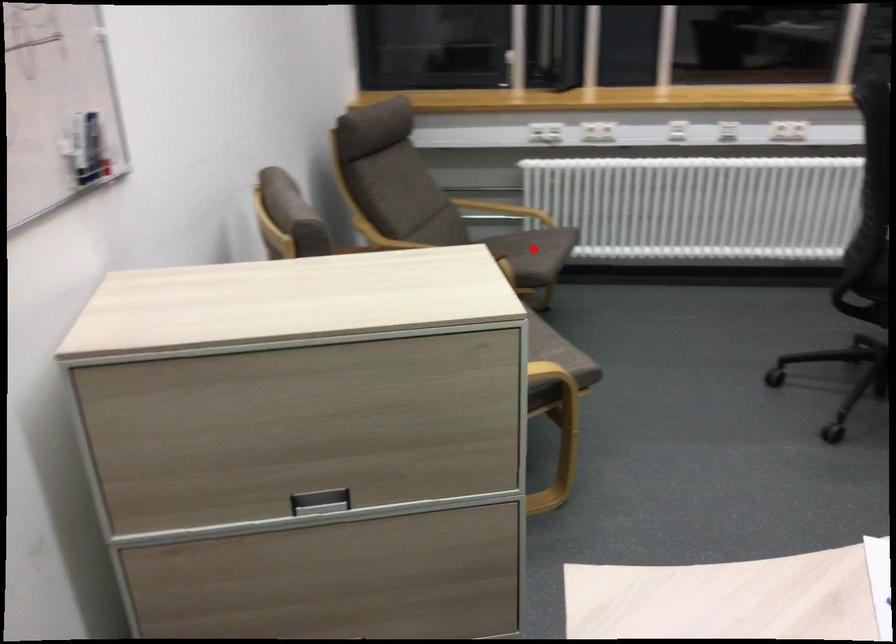
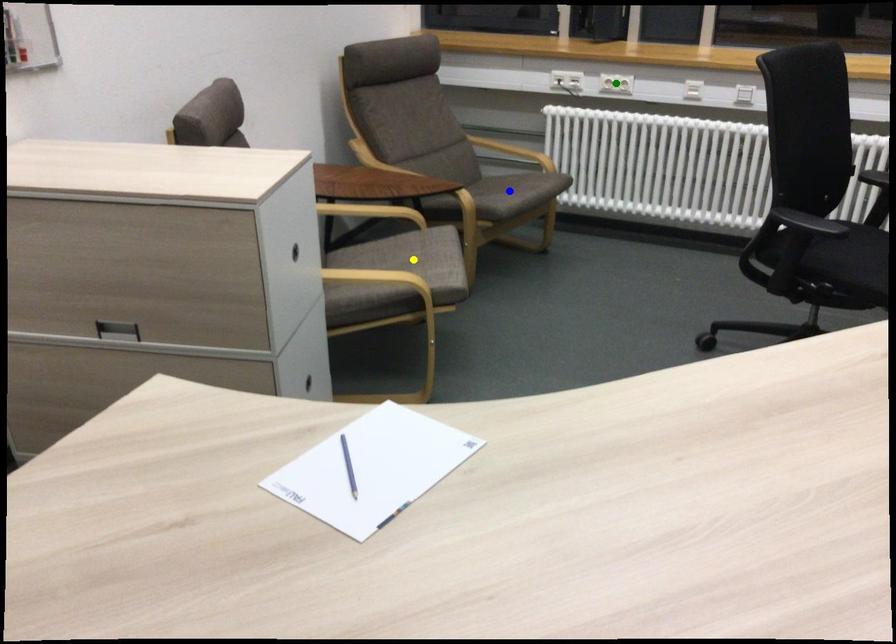
Question: I am providing you with two images of the same scene from different viewpoints. A red point is marked on the first image. You are given multiple points on the second image. Which point in image 2 is actually the same real-world point as the red point in image 1?

Choices:
 (A) yellow point
 (B) blue point
 (C) green point

Answer: (B)